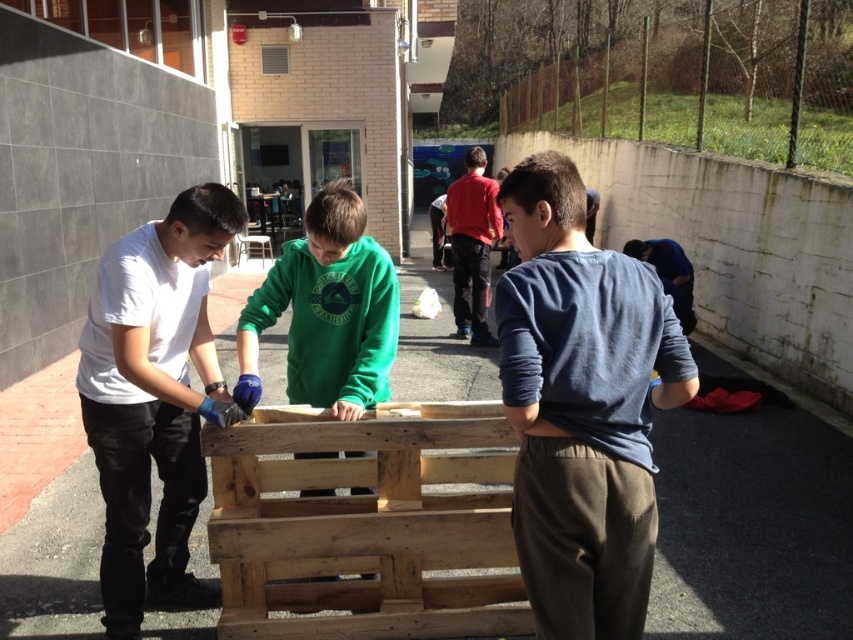
Question: Can you confirm if blue cotton shirt at center is positioned above white matte shirt at left?

Choices:
 (A) no
 (B) yes

Answer: (B)

Question: Can you confirm if blue cotton shirt at center is positioned above white matte shirt at left?

Choices:
 (A) no
 (B) yes

Answer: (B)

Question: Considering the real-world distances, which object is closest to the blue cotton shirt at center?

Choices:
 (A) white matte shirt at left
 (B) green matte sweatshirt at center

Answer: (B)

Question: Which of the following is the farthest from the observer?

Choices:
 (A) (358, 401)
 (B) (534, 248)

Answer: (A)

Question: Among these points, which one is farthest from the camera?

Choices:
 (A) (358, 356)
 (B) (628, 272)
 (C) (155, 436)

Answer: (C)

Question: Can you confirm if white matte shirt at left is wider than green matte sweatshirt at center?

Choices:
 (A) no
 (B) yes

Answer: (B)